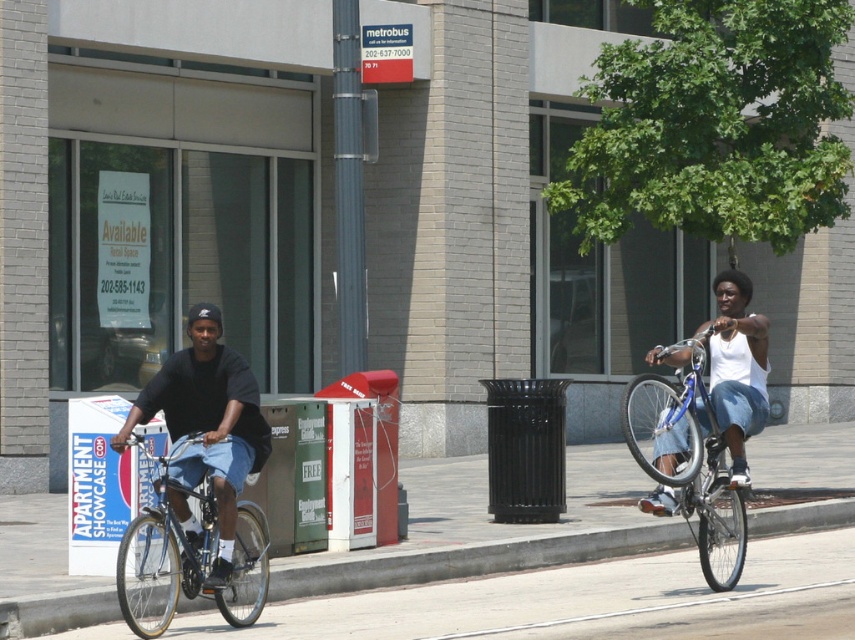
From the picture: Is gray concrete curb at lower left in front of shiny blue bicycle at right?

No, it is not.

The width and height of the screenshot is (855, 640). What are the coordinates of `gray concrete curb at lower left` in the screenshot? It's located at 470,560.

Find the location of `gray concrete curb at lower left`. gray concrete curb at lower left is located at coordinates (470, 560).

Does gray concrete curb at lower left lie behind matte black shirt at left?

Yes, gray concrete curb at lower left is behind matte black shirt at left.

From the picture: Who is positioned more to the right, gray concrete curb at lower left or matte black shirt at left?

Positioned to the right is gray concrete curb at lower left.

Who is more forward, (286,573) or (228,552)?

Point (228,552)

Where is `gray concrete curb at lower left`? gray concrete curb at lower left is located at coordinates (470, 560).

Which is more to the right, shiny blue bicycle at right or silver metallic bicycle at left?

From the viewer's perspective, shiny blue bicycle at right appears more on the right side.

Can you confirm if shiny blue bicycle at right is taller than silver metallic bicycle at left?

Yes.

At what (x,y) coordinates should I click in order to perform the action: click on shiny blue bicycle at right. Please return your answer as a coordinate pair (x, y). This screenshot has height=640, width=855. Looking at the image, I should click on (691, 458).